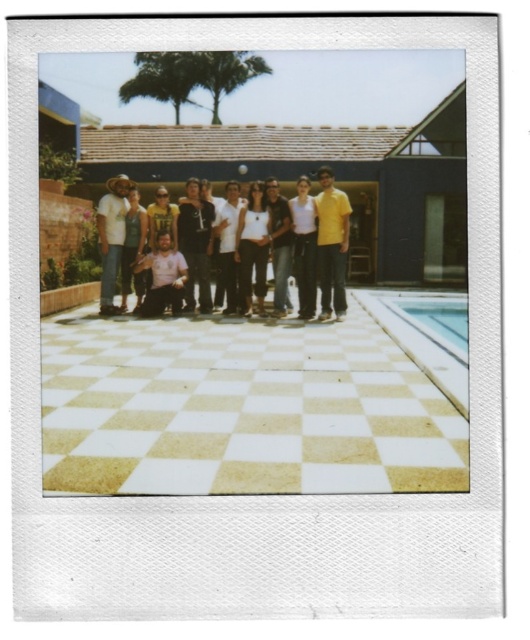
Question: Does matte black shirt at center have a lesser width compared to matte white shirt at left?

Choices:
 (A) no
 (B) yes

Answer: (A)

Question: Among these objects, which one is nearest to the camera?

Choices:
 (A) dark gray hoodie at center
 (B) white cotton shirt at center
 (C) yellow matte shirt at center
 (D) dark brown leather jacket at center

Answer: (C)

Question: Can you confirm if matte white shirt at left is positioned to the right of dark brown leather jacket at center?

Choices:
 (A) no
 (B) yes

Answer: (A)

Question: Which point appears closest to the camera in this image?

Choices:
 (A) (278, 312)
 (B) (178, 224)
 (C) (238, 186)
 (D) (330, 188)

Answer: (D)

Question: Which object is the farthest from the matte white shirt at left?

Choices:
 (A) dark brown leather jacket at center
 (B) dark gray hoodie at center
 (C) matte black shirt at center

Answer: (A)

Question: Does yellow matte shirt at center appear under clear glass pool at lower right?

Choices:
 (A) no
 (B) yes

Answer: (A)